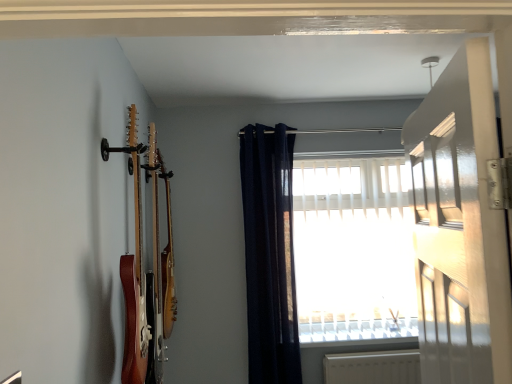
Question: Is wooden acoustic guitar at left, placed as the second guitar when sorted from back to front, inside the boundaries of wooden acoustic guitar at left, which ranks as the second guitar in front-to-back order, or outside?

Choices:
 (A) inside
 (B) outside

Answer: (B)

Question: Considering the positions of wooden acoustic guitar at left, placed as the second guitar when sorted from back to front, and wooden acoustic guitar at left, which is the 1th guitar from back to front, in the image, is wooden acoustic guitar at left, placed as the second guitar when sorted from back to front, wider or thinner than wooden acoustic guitar at left, which is the 1th guitar from back to front,?

Choices:
 (A) thin
 (B) wide

Answer: (B)

Question: Based on their relative distances, which object is nearer to the navy blue fabric curtain at upper center?

Choices:
 (A) wooden acoustic guitar at left, the 1th guitar positioned from the front
 (B) white glossy door at upper right
 (C) white plastic window sill at lower center
 (D) white translucent blinds at center
 (E) wooden acoustic guitar at left, which is the 1th guitar from back to front

Answer: (D)

Question: Based on their relative distances, which object is nearer to the wooden acoustic guitar at left, which is the 1th guitar from back to front?

Choices:
 (A) navy blue fabric curtain at upper center
 (B) white translucent blinds at center
 (C) white plastic window sill at lower center
 (D) white glossy door at upper right
 (E) wooden acoustic guitar at left, the 1th guitar positioned from the front

Answer: (A)